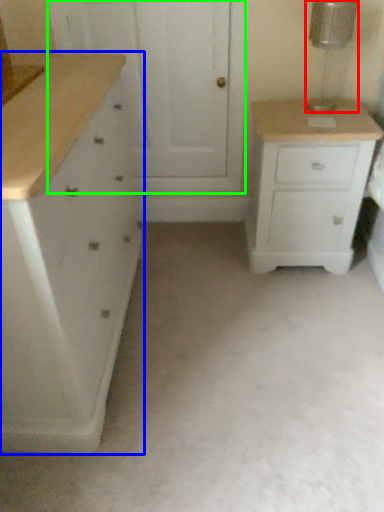
Question: Considering the real-world distances, which object is closest to lamp (highlighted by a red box)? chest of drawers (highlighted by a blue box) or screen door (highlighted by a green box).

Choices:
 (A) chest of drawers
 (B) screen door

Answer: (B)